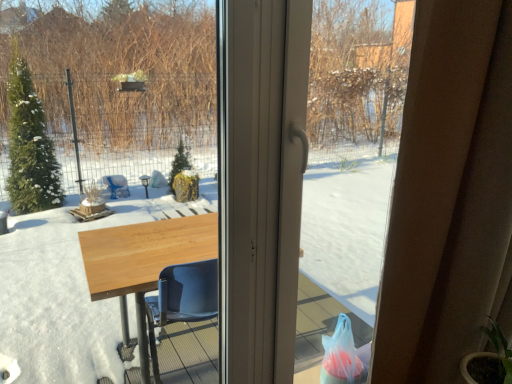
Question: Should I look upward or downward to see white plastic screen door at center?

Choices:
 (A) up
 (B) down

Answer: (B)